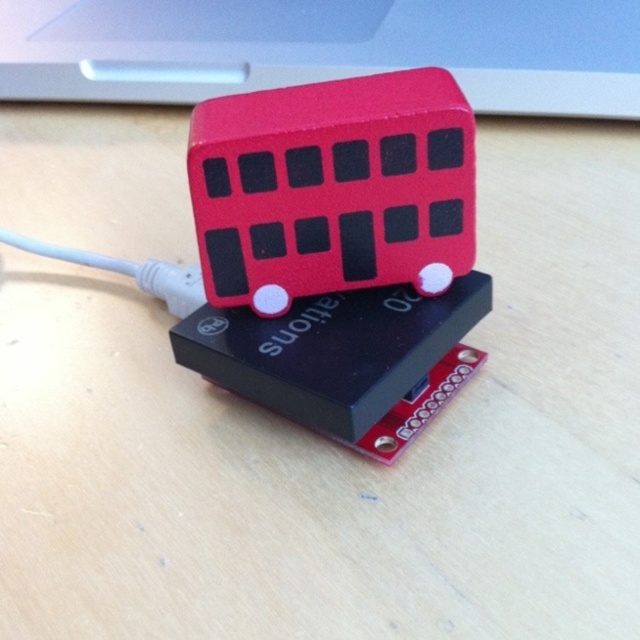
Is matte red bus at upper center wider than rubber bus at center?

Correct, the width of matte red bus at upper center exceeds that of rubber bus at center.

Who is more forward, [358,8] or [316,168]?

Point [316,168]

You are a GUI agent. You are given a task and a screenshot of the screen. Output one action in this format:
    pyautogui.click(x=<x>, y=<y>)
    Task: Click on the matte red bus at upper center
    The image size is (640, 640).
    Given the screenshot: What is the action you would take?
    pyautogui.click(x=324, y=49)